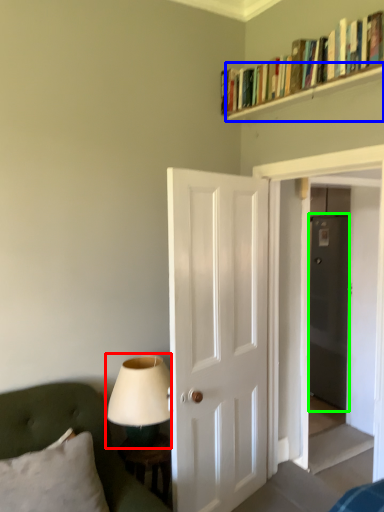
Question: Considering the real-world distances, which object is farthest from table lamp (highlighted by a red box)? shelf (highlighted by a blue box) or glass door (highlighted by a green box)?

Choices:
 (A) shelf
 (B) glass door

Answer: (B)